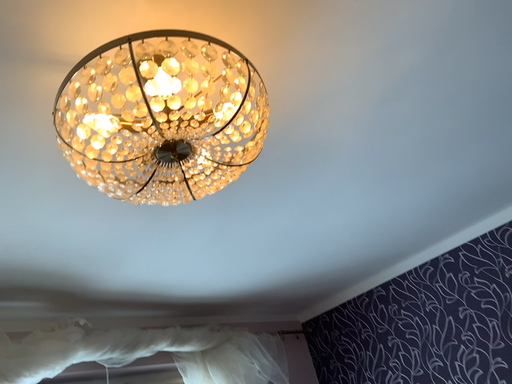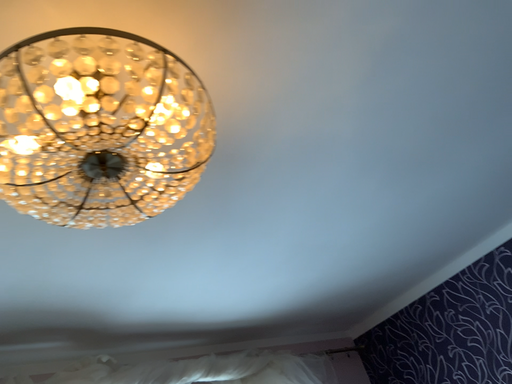
Question: Which way did the camera rotate in the video?

Choices:
 (A) rotated left
 (B) rotated right

Answer: (A)